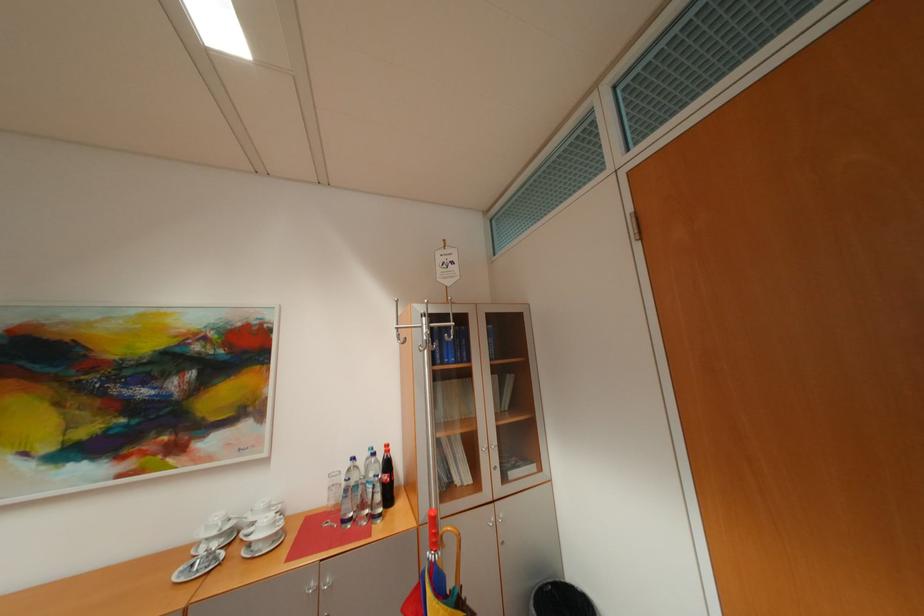
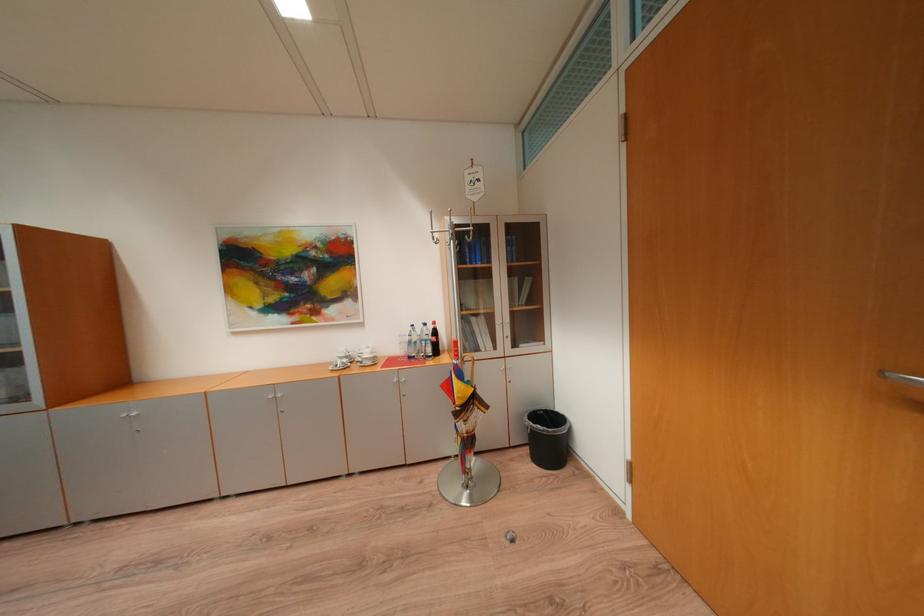
In the second image, find the point that corresponds to point 229,536 in the first image.

(355, 359)